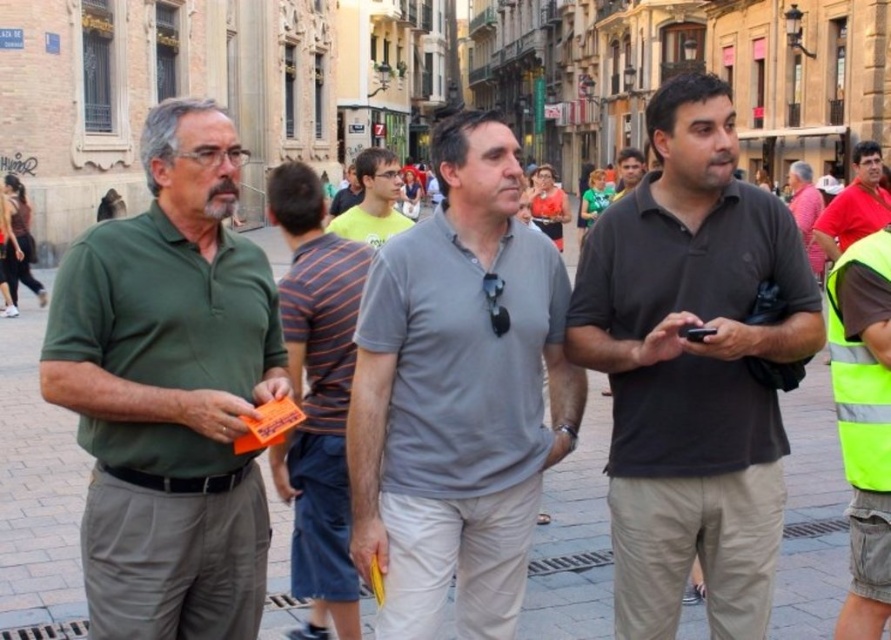
Which is in front, point (458, 422) or point (366, 156)?

Positioned in front is point (458, 422).

Who is shorter, gray cotton shirt at center or light gray shirt at center?

Standing shorter between the two is gray cotton shirt at center.

You are a GUI agent. You are given a task and a screenshot of the screen. Output one action in this format:
    pyautogui.click(x=<x>, y=<y>)
    Task: Click on the gray cotton shirt at center
    The height and width of the screenshot is (640, 891).
    Given the screenshot: What is the action you would take?
    pyautogui.click(x=458, y=394)

Where is `green matte shirt at left`? This screenshot has height=640, width=891. green matte shirt at left is located at coordinates (169, 392).

Measure the distance between point (97, 637) and camera.

The distance of point (97, 637) from camera is 25.01 meters.

At what (x,y) coordinates should I click in order to perform the action: click on green matte shirt at left. Please return your answer as a coordinate pair (x, y). This screenshot has width=891, height=640. Looking at the image, I should click on (169, 392).

Does point (674, 337) come behind point (440, 264)?

That is False.

Can you confirm if dark brown cotton polo shirt at center is smaller than gray cotton shirt at center?

No, dark brown cotton polo shirt at center is not smaller than gray cotton shirt at center.

Image resolution: width=891 pixels, height=640 pixels. I want to click on dark brown cotton polo shirt at center, so click(692, 369).